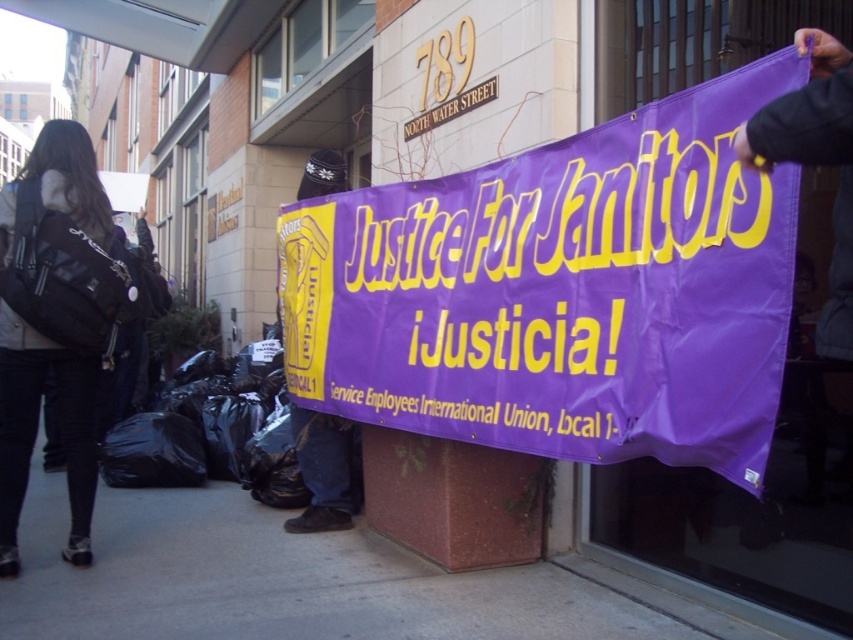
You are standing at the entrance of the building at 789 North Water Street. There is a point marked at coordinates (563, 291). What object is located at that point?

The point at coordinates (563, 291) marks the purple fabric banner at center.

You are a delivery person who needs to place a large box between the purple fabric banner at lower center and the black fabric backpack at left. The box requires 3 feet of space. Can you fit it there?

The distance between the purple fabric banner at lower center and the black fabric backpack at left is 3.36 feet, which is sufficient to accommodate the 3 feet required for the box. Therefore, the box can be placed there.

You are a delivery person who needs to carry both the purple fabric banner at lower center and the black fabric backpack at left. Which item should you pick up first if you want to place the taller object on the lower shelf?

The black fabric backpack at left is taller than the purple fabric banner at lower center, so you should pick up the black fabric backpack at left first and place it on the lower shelf.